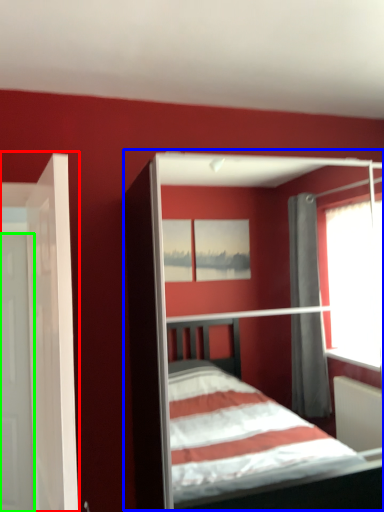
Question: Which object is positioned closest to door (highlighted by a red box)? Select from bed (highlighted by a blue box) and door (highlighted by a green box).

Choices:
 (A) bed
 (B) door

Answer: (B)